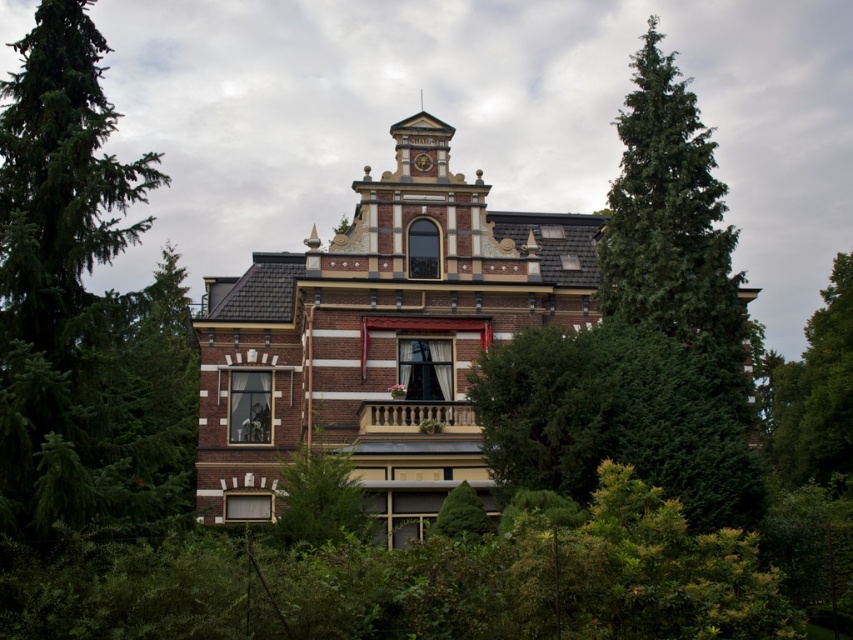
You are standing in front of the Victorian house and notice two trees. The green evergreen tree at left and the green leafy tree at lower center. Which tree is closer to you?

The green evergreen tree at left is closer to you as it is in front of the green leafy tree at lower center.